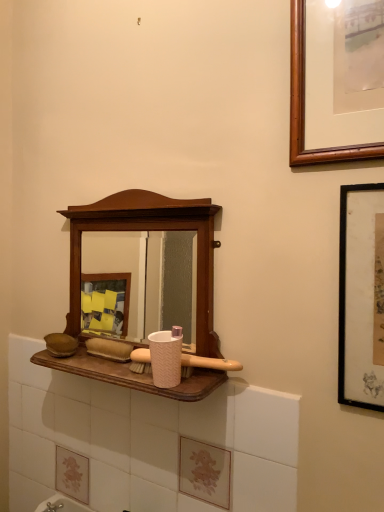
Question: Could you tell me if pink textured cup at center is turned towards black matte picture frame at right?

Choices:
 (A) yes
 (B) no

Answer: (B)

Question: From the image's perspective, is pink textured cup at center under black matte picture frame at right?

Choices:
 (A) yes
 (B) no

Answer: (A)

Question: Is pink textured cup at center bigger than black matte picture frame at right?

Choices:
 (A) no
 (B) yes

Answer: (A)

Question: Is pink textured cup at center smaller than black matte picture frame at right?

Choices:
 (A) no
 (B) yes

Answer: (B)

Question: Can you confirm if pink textured cup at center is wider than black matte picture frame at right?

Choices:
 (A) yes
 (B) no

Answer: (A)

Question: Is pink textured cup at center beside black matte picture frame at right?

Choices:
 (A) no
 (B) yes

Answer: (A)

Question: Is black matte picture frame at right far away from wooden medicine cabinet at center?

Choices:
 (A) yes
 (B) no

Answer: (B)

Question: Is black matte picture frame at right turned away from wooden medicine cabinet at center?

Choices:
 (A) no
 (B) yes

Answer: (A)

Question: From a real-world perspective, is black matte picture frame at right positioned under wooden medicine cabinet at center based on gravity?

Choices:
 (A) yes
 (B) no

Answer: (A)

Question: Is black matte picture frame at right not inside wooden medicine cabinet at center?

Choices:
 (A) no
 (B) yes

Answer: (B)

Question: Is black matte picture frame at right closer to the viewer compared to wooden medicine cabinet at center?

Choices:
 (A) no
 (B) yes

Answer: (B)

Question: Is black matte picture frame at right further to the viewer compared to wooden medicine cabinet at center?

Choices:
 (A) yes
 (B) no

Answer: (B)

Question: Can you confirm if pink textured brush at center is thinner than wooden medicine cabinet at center?

Choices:
 (A) yes
 (B) no

Answer: (A)